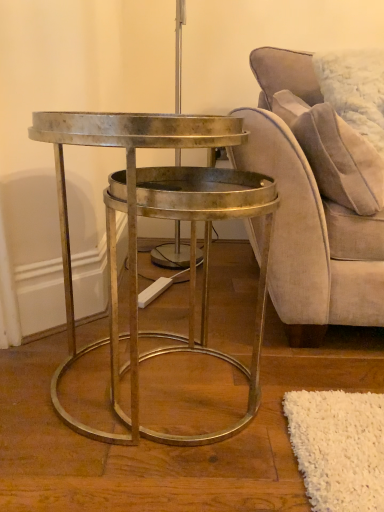
Question: Does suede-like beige pillow at upper right have a lesser width compared to metallic gold table at center?

Choices:
 (A) no
 (B) yes

Answer: (B)

Question: Is suede-like beige pillow at upper right smaller than metallic gold table at center?

Choices:
 (A) no
 (B) yes

Answer: (B)

Question: Is suede-like beige pillow at upper right directly adjacent to metallic gold table at center?

Choices:
 (A) no
 (B) yes

Answer: (A)

Question: Is suede-like beige pillow at upper right closer to camera compared to metallic gold table at center?

Choices:
 (A) yes
 (B) no

Answer: (B)

Question: From the image's perspective, does suede-like beige pillow at upper right appear higher than metallic gold table at center?

Choices:
 (A) yes
 (B) no

Answer: (A)

Question: From a real-world perspective, does suede-like beige pillow at upper right sit lower than metallic gold table at center?

Choices:
 (A) yes
 (B) no

Answer: (B)

Question: Is metallic gold table at center closer to camera compared to suede beige chair at right?

Choices:
 (A) yes
 (B) no

Answer: (A)

Question: From a real-world perspective, is metallic gold table at center over suede beige chair at right?

Choices:
 (A) no
 (B) yes

Answer: (A)

Question: Can you confirm if metallic gold table at center is positioned to the left of suede beige chair at right?

Choices:
 (A) yes
 (B) no

Answer: (A)

Question: From the image's perspective, does metallic gold table at center appear higher than suede beige chair at right?

Choices:
 (A) no
 (B) yes

Answer: (A)

Question: Would you say suede beige chair at right is part of metallic gold table at center's contents?

Choices:
 (A) yes
 (B) no

Answer: (B)

Question: Is there a large distance between metallic gold table at center and suede beige chair at right?

Choices:
 (A) no
 (B) yes

Answer: (A)

Question: Is suede-like beige pillow at upper right shorter than suede beige chair at right?

Choices:
 (A) yes
 (B) no

Answer: (A)